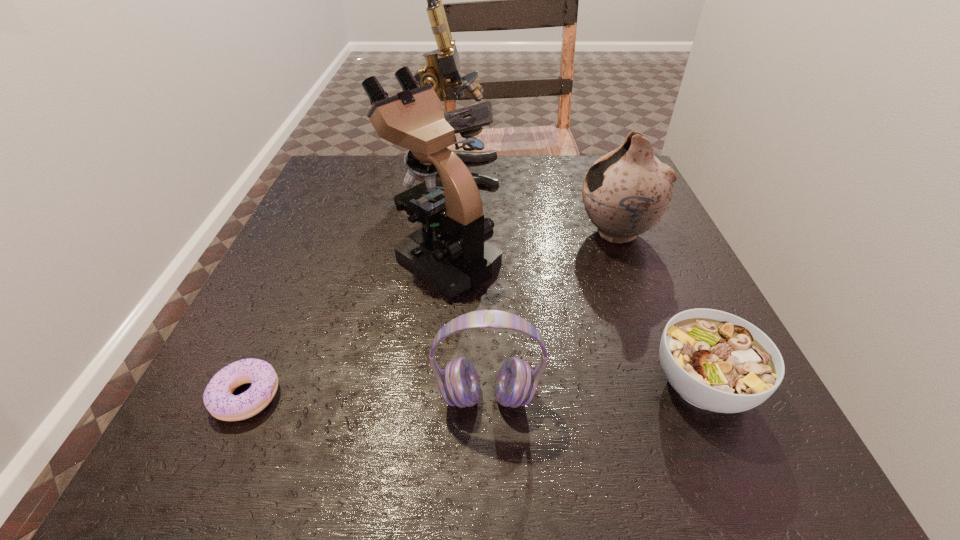
Where is `object that is at the left edge`? Image resolution: width=960 pixels, height=540 pixels. object that is at the left edge is located at coordinates (220, 402).

In order to click on pottery present at the right edge in this screenshot , I will do pos(626,192).

Locate an element on the screen. soup bowl at the right edge is located at coordinates (716, 361).

The image size is (960, 540). Identify the location of object that is at the near left corner. (220, 402).

Locate an element on the screen. The width and height of the screenshot is (960, 540). object that is at the near right corner is located at coordinates (716, 361).

Locate an element on the screen. free space at the far edge of the desktop is located at coordinates (533, 168).

Identify the location of vacant space at the near edge. The height and width of the screenshot is (540, 960). (432, 423).

Identify the location of vacant space at the left edge of the desktop. (274, 414).

In the image, there is a desktop. Identify the location of free space at the right edge. This screenshot has width=960, height=540. (669, 260).

This screenshot has height=540, width=960. Identify the location of vacant space at the near left corner of the desktop. (242, 484).